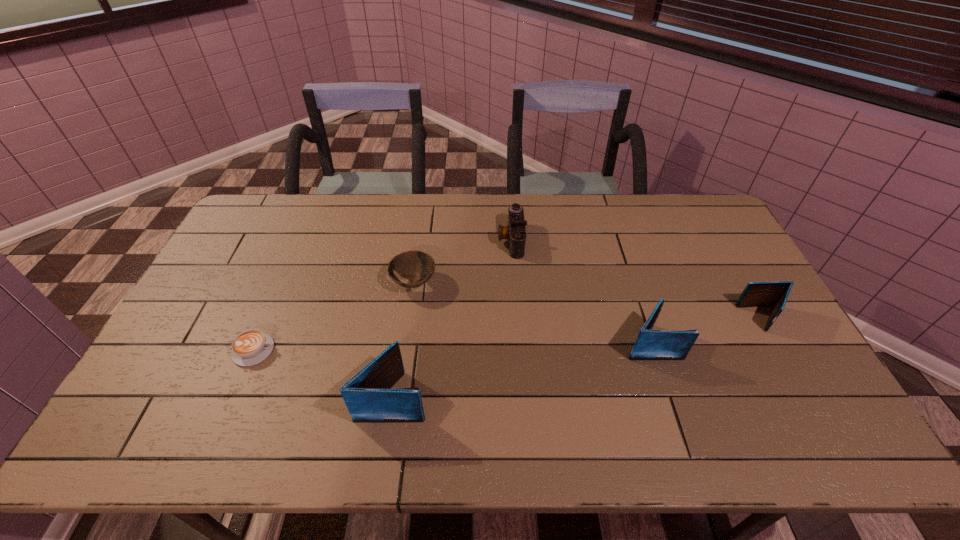
Where is `the fifth tallest object`? the fifth tallest object is located at coordinates (415, 265).

Where is `bowl`? The width and height of the screenshot is (960, 540). bowl is located at coordinates (415, 265).

Where is `vacant region located 0.400m on the exterior surface of the nearest object`? The image size is (960, 540). vacant region located 0.400m on the exterior surface of the nearest object is located at coordinates (588, 396).

The height and width of the screenshot is (540, 960). What are the coordinates of `blank space located on the exterior surface of the fifth shortest object` in the screenshot? It's located at (739, 342).

The image size is (960, 540). What are the coordinates of `vacant space situated on the exterior surface of the rightmost object` in the screenshot? It's located at (651, 319).

At what (x,y) coordinates should I click in order to perform the action: click on blank space located 0.090m on the exterior surface of the rightmost object. Please return your answer as a coordinate pair (x, y). This screenshot has width=960, height=540. Looking at the image, I should click on click(x=710, y=319).

Where is `vacant area situated on the exterior surface of the rightmost object`? vacant area situated on the exterior surface of the rightmost object is located at coordinates (700, 319).

Image resolution: width=960 pixels, height=540 pixels. In order to click on free space located on the lens of the camera in this screenshot , I will do `click(411, 240)`.

Where is `blank space located 0.240m on the lens of the camera`? This screenshot has height=540, width=960. blank space located 0.240m on the lens of the camera is located at coordinates (428, 240).

Find the location of `free space located 0.230m on the lens of the camera`. free space located 0.230m on the lens of the camera is located at coordinates pyautogui.click(x=431, y=240).